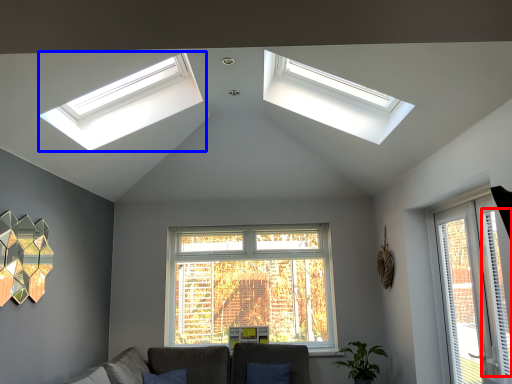
Question: Which point is further to the camera, curtain (highlighted by a red box) or window (highlighted by a blue box)?

Choices:
 (A) curtain
 (B) window

Answer: (B)